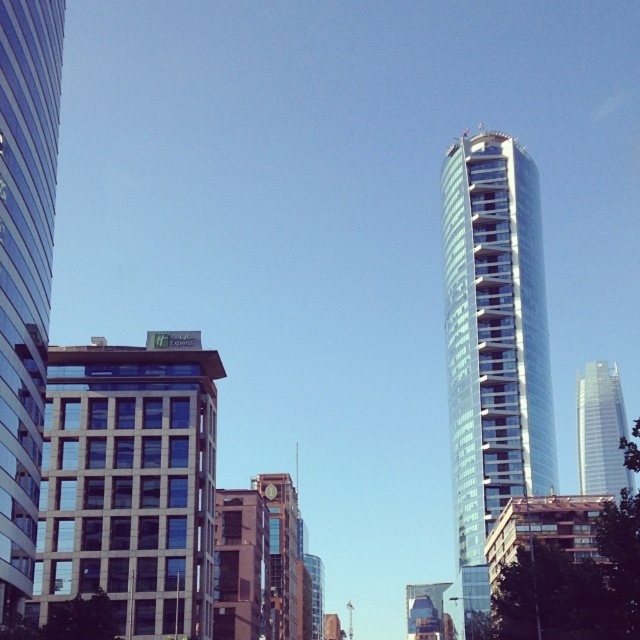
Who is higher up, transparent glass tower at right or glassy reflective skyscraper at left?

glassy reflective skyscraper at left is higher up.

Between transparent glass tower at right and glassy reflective skyscraper at left, which one is positioned lower?

transparent glass tower at right is below.

This screenshot has width=640, height=640. Describe the element at coordinates (493, 336) in the screenshot. I see `transparent glass tower at right` at that location.

Identify the location of transparent glass tower at right. Image resolution: width=640 pixels, height=640 pixels. (493, 336).

Which is above, glassy reflective skyscraper at left or brick textured clock tower at center?

Positioned higher is glassy reflective skyscraper at left.

Between point (28, 568) and point (305, 627), which one is positioned behind?

The point (305, 627) is more distant.

Find the location of `glassy reflective skyscraper at left`. glassy reflective skyscraper at left is located at coordinates (24, 272).

Is the position of beige stone building at center less distant than that of transparent glass tower at right?

Yes, it is in front of transparent glass tower at right.

Can you confirm if beige stone building at center is bigger than transparent glass tower at right?

No.

The image size is (640, 640). What do you see at coordinates (131, 483) in the screenshot?
I see `beige stone building at center` at bounding box center [131, 483].

Find the location of a particular element. Image resolution: width=640 pixels, height=640 pixels. beige stone building at center is located at coordinates [131, 483].